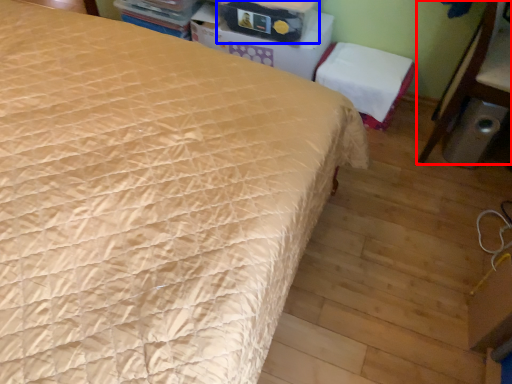
Question: Which object appears closest to the camera in this image, furniture (highlighted by a red box) or storage box (highlighted by a blue box)?

Choices:
 (A) furniture
 (B) storage box

Answer: (A)